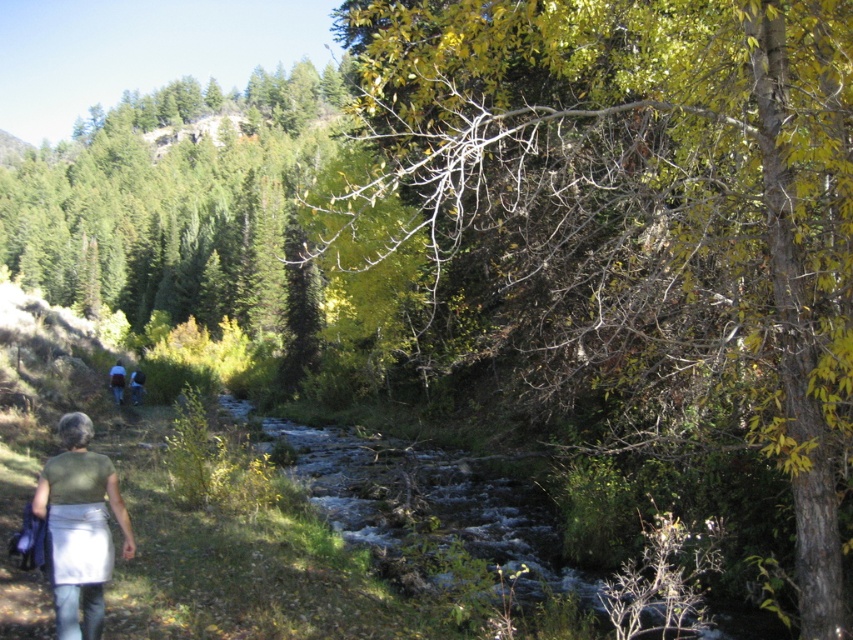
You are standing at the edge of the stream and notice two items at lower left. Which item is nearer to you, the light green fabric at lower left or the green fabric backpack at lower left?

The light green fabric at lower left is closer to the viewer than the green fabric backpack at lower left, so the light green fabric at lower left is nearer to you.

You are planning to take a photo of the green leafy tree at upper right and the green fabric backpack at lower left. Which object should you zoom in on to capture more details without moving the camera?

You should zoom in on the green leafy tree at upper right because its width surpasses that of the green fabric backpack at lower left, allowing for more detailed capture without moving the camera.

You are planning to take a photo of the green leafy tree at upper right and the green fabric backpack at lower left. Which object should you focus on first if you want to capture both in a single frame without moving the camera?

You should focus on the green leafy tree at upper right first because it is larger than the green fabric backpack at lower left, allowing it to be more prominent in the frame while still including the smaller backpack.